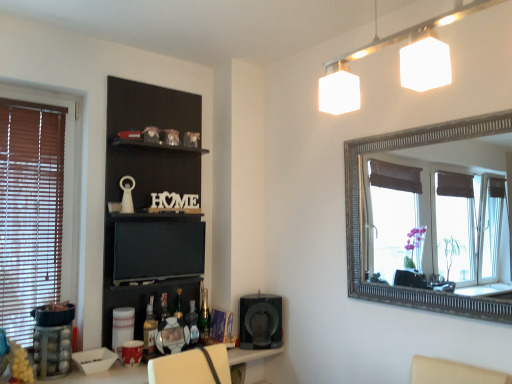
At what (x,y) coordinates should I click in order to perform the action: click on free space underneath black matte speaker at lower center (from a real-world perspective). Please return your answer as a coordinate pair (x, y). The width and height of the screenshot is (512, 384). Looking at the image, I should click on (260, 347).